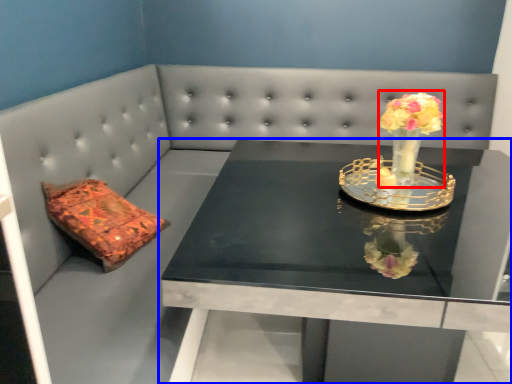
Question: Which object appears farthest to the camera in this image, floral arrangement (highlighted by a red box) or table (highlighted by a blue box)?

Choices:
 (A) floral arrangement
 (B) table

Answer: (A)